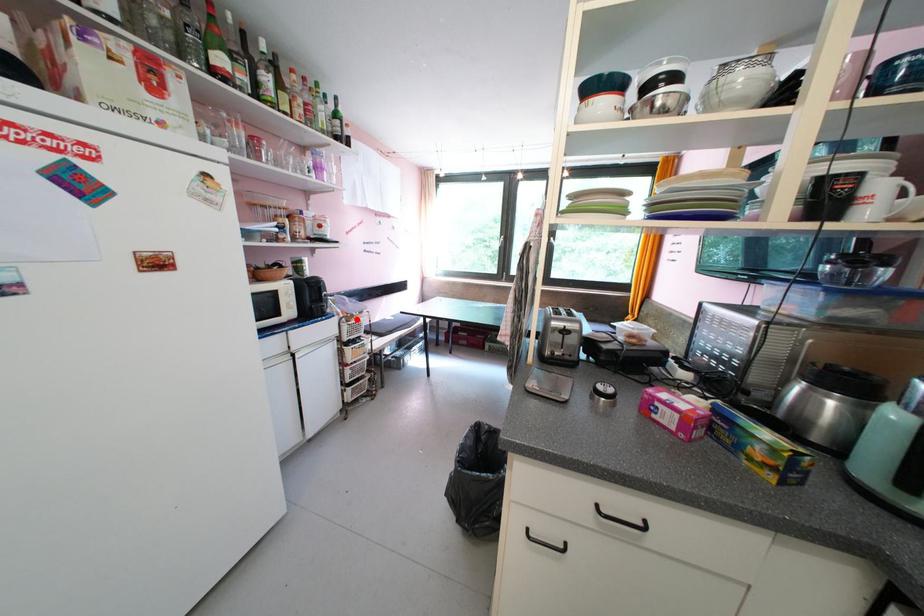
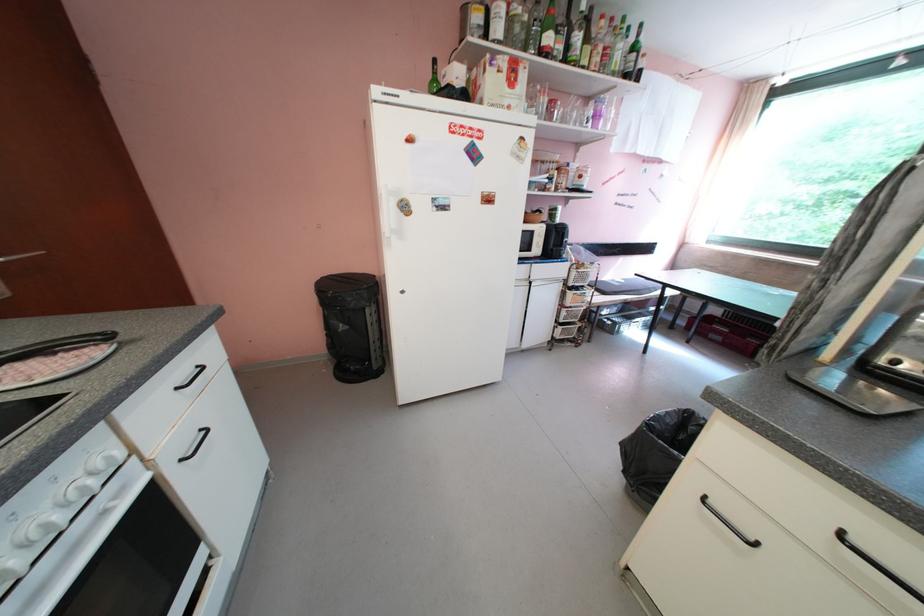
Question: I am providing you with two images of the same scene from different viewpoints. In image1, a red point is highlighted. Considering the same 3D point in image2, which of the following is correct?

Choices:
 (A) It is closer
 (B) It is farther

Answer: (B)